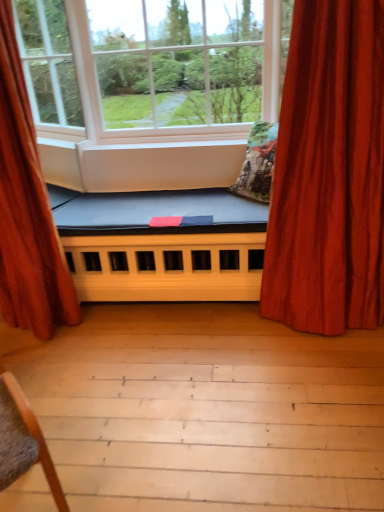
What do you see at coordinates (27, 210) in the screenshot?
I see `velvet red curtain at left, which is the 2th curtain in right-to-left order` at bounding box center [27, 210].

Locate an element on the screen. This screenshot has height=512, width=384. white matte window at center, positioned as the first window in right-to-left order is located at coordinates (184, 64).

The image size is (384, 512). What do you see at coordinates (161, 245) in the screenshot?
I see `blue fabric futon at center` at bounding box center [161, 245].

Looking at this image, measure the distance between blue fabric futon at center and camera.

blue fabric futon at center and camera are 2.18 meters apart.

Where is `velvet red curtain at left, which is the 2th curtain in right-to-left order`? The image size is (384, 512). velvet red curtain at left, which is the 2th curtain in right-to-left order is located at coordinates point(27,210).

Is white matte window at center, which ranks as the 2th window in left-to-right order, positioned before clear glass window at upper center, arranged as the 1th window when viewed from the left?

Yes, white matte window at center, which ranks as the 2th window in left-to-right order, is closer to the camera.

In the scene shown: From a real-world perspective, relative to clear glass window at upper center, arranged as the 1th window when viewed from the left, is white matte window at center, which ranks as the 2th window in left-to-right order, vertically above or below?

In terms of real-world spatial position, white matte window at center, which ranks as the 2th window in left-to-right order, is below clear glass window at upper center, arranged as the 1th window when viewed from the left.

Is white matte window at center, which ranks as the 2th window in left-to-right order, bigger than clear glass window at upper center, which appears as the 2th window when viewed from the right?

Indeed, white matte window at center, which ranks as the 2th window in left-to-right order, has a larger size compared to clear glass window at upper center, which appears as the 2th window when viewed from the right.

In order to click on window behind the white matte window at center, positioned as the first window in right-to-left order in this screenshot , I will do `click(48, 63)`.

Is velvet red curtain at right, arranged as the 2th curtain when viewed from the left, at the left side of blue fabric futon at center?

No, velvet red curtain at right, arranged as the 2th curtain when viewed from the left, is not to the left of blue fabric futon at center.

Is velvet red curtain at right, arranged as the 2th curtain when viewed from the left, outside of blue fabric futon at center?

Yes, velvet red curtain at right, arranged as the 2th curtain when viewed from the left, is outside of blue fabric futon at center.

Is velvet red curtain at right, the 1th curtain when ordered from right to left, touching blue fabric futon at center?

No, velvet red curtain at right, the 1th curtain when ordered from right to left, is not in contact with blue fabric futon at center.

From a real-world perspective, who is located higher, velvet red curtain at right, arranged as the 2th curtain when viewed from the left, or blue fabric futon at center?

From a 3D spatial view, velvet red curtain at right, arranged as the 2th curtain when viewed from the left, is above.

Looking at this image, is textured floral pillow at center turned away from velvet red curtain at left, the 1th curtain in the left-to-right sequence?

No, textured floral pillow at center is not facing away from velvet red curtain at left, the 1th curtain in the left-to-right sequence.

Is textured floral pillow at center bigger or smaller than velvet red curtain at left, which is the 2th curtain in right-to-left order?

textured floral pillow at center is smaller than velvet red curtain at left, which is the 2th curtain in right-to-left order.

Considering the positions of points (272, 123) and (39, 253), is point (272, 123) closer to camera compared to point (39, 253)?

No, it is not.

From their relative heights in the image, would you say textured floral pillow at center is taller or shorter than velvet red curtain at left, the 1th curtain in the left-to-right sequence?

Considering their sizes, textured floral pillow at center has less height than velvet red curtain at left, the 1th curtain in the left-to-right sequence.

Is textured floral pillow at center aimed at velvet red curtain at right, the 1th curtain when ordered from right to left?

No, textured floral pillow at center is not facing towards velvet red curtain at right, the 1th curtain when ordered from right to left.

From a real-world perspective, count 1st curtains upward from the textured floral pillow at center and point to it. Please provide its 2D coordinates.

[(329, 173)]

From a real-world perspective, is textured floral pillow at center physically located above or below velvet red curtain at right, the 1th curtain when ordered from right to left?

Clearly, from a real-world perspective, textured floral pillow at center is below velvet red curtain at right, the 1th curtain when ordered from right to left.

Considering the sizes of objects clear glass window at upper center, arranged as the 1th window when viewed from the left, and white matte window at center, positioned as the first window in right-to-left order, in the image provided, who is shorter, clear glass window at upper center, arranged as the 1th window when viewed from the left, or white matte window at center, positioned as the first window in right-to-left order,?

With less height is clear glass window at upper center, arranged as the 1th window when viewed from the left.

Is clear glass window at upper center, which appears as the 2th window when viewed from the right, wider than white matte window at center, which ranks as the 2th window in left-to-right order?

No.

Who is smaller, clear glass window at upper center, arranged as the 1th window when viewed from the left, or white matte window at center, positioned as the first window in right-to-left order?

Smaller between the two is clear glass window at upper center, arranged as the 1th window when viewed from the left.

Would you say clear glass window at upper center, which appears as the 2th window when viewed from the right, is to the left or to the right of white matte window at center, which ranks as the 2th window in left-to-right order, in the picture?

clear glass window at upper center, which appears as the 2th window when viewed from the right, is to the left of white matte window at center, which ranks as the 2th window in left-to-right order.

Could you tell me if white matte window at center, which ranks as the 2th window in left-to-right order, is turned towards velvet red curtain at right, the 1th curtain when ordered from right to left?

No.

From a real-world perspective, is white matte window at center, which ranks as the 2th window in left-to-right order, positioned over velvet red curtain at right, the 1th curtain when ordered from right to left, based on gravity?

Correct, in the physical world, white matte window at center, which ranks as the 2th window in left-to-right order, is higher than velvet red curtain at right, the 1th curtain when ordered from right to left.

Would you say velvet red curtain at right, the 1th curtain when ordered from right to left, is part of white matte window at center, which ranks as the 2th window in left-to-right order,'s contents?

No, velvet red curtain at right, the 1th curtain when ordered from right to left, is not inside white matte window at center, which ranks as the 2th window in left-to-right order.

Considering the positions of points (187, 83) and (294, 312), is point (187, 83) closer to camera compared to point (294, 312)?

No.

Is velvet red curtain at right, arranged as the 2th curtain when viewed from the left, wider than textured floral pillow at center?

Indeed, velvet red curtain at right, arranged as the 2th curtain when viewed from the left, has a greater width compared to textured floral pillow at center.

How much distance is there between velvet red curtain at right, arranged as the 2th curtain when viewed from the left, and textured floral pillow at center?

23.39 inches.

Does velvet red curtain at right, the 1th curtain when ordered from right to left, have a greater height compared to textured floral pillow at center?

Correct, velvet red curtain at right, the 1th curtain when ordered from right to left, is much taller as textured floral pillow at center.

Is velvet red curtain at right, arranged as the 2th curtain when viewed from the left, positioned beyond the bounds of textured floral pillow at center?

Yes.

Where is `window directly beneath the clear glass window at upper center, which appears as the 2th window when viewed from the right (from a real-world perspective)`? The image size is (384, 512). window directly beneath the clear glass window at upper center, which appears as the 2th window when viewed from the right (from a real-world perspective) is located at coordinates (184, 64).

Find the location of a particular element. curtain that appears on the right of blue fabric futon at center is located at coordinates (329, 173).

From the image, which object appears to be farther from velvet red curtain at right, the 1th curtain when ordered from right to left, velvet red curtain at left, which is the 2th curtain in right-to-left order, or clear glass window at upper center, arranged as the 1th window when viewed from the left?

clear glass window at upper center, arranged as the 1th window when viewed from the left, is positioned further to the anchor velvet red curtain at right, the 1th curtain when ordered from right to left.

Based on their spatial positions, is velvet red curtain at left, the 1th curtain in the left-to-right sequence, or velvet red curtain at right, the 1th curtain when ordered from right to left, further from textured floral pillow at center?

velvet red curtain at left, the 1th curtain in the left-to-right sequence.

Consider the image. Looking at the image, which one is located closer to velvet red curtain at right, the 1th curtain when ordered from right to left, white matte window at center, which ranks as the 2th window in left-to-right order, or textured floral pillow at center?

The object closer to velvet red curtain at right, the 1th curtain when ordered from right to left, is textured floral pillow at center.

In the scene shown: Estimate the real-world distances between objects in this image. Which object is closer to textured floral pillow at center, blue fabric futon at center or velvet red curtain at left, the 1th curtain in the left-to-right sequence?

Among the two, blue fabric futon at center is located nearer to textured floral pillow at center.

Looking at the image, which one is located further to velvet red curtain at left, the 1th curtain in the left-to-right sequence, blue fabric futon at center or textured floral pillow at center?

The object further to velvet red curtain at left, the 1th curtain in the left-to-right sequence, is textured floral pillow at center.

Considering their positions, is velvet red curtain at left, the 1th curtain in the left-to-right sequence, positioned further to white matte window at center, positioned as the first window in right-to-left order, than velvet red curtain at right, the 1th curtain when ordered from right to left?

velvet red curtain at right, the 1th curtain when ordered from right to left, is positioned further to the anchor white matte window at center, positioned as the first window in right-to-left order.

Based on their spatial positions, is textured floral pillow at center or clear glass window at upper center, which appears as the 2th window when viewed from the right, further from velvet red curtain at left, the 1th curtain in the left-to-right sequence?

textured floral pillow at center lies further to velvet red curtain at left, the 1th curtain in the left-to-right sequence, than the other object.

Which object lies nearer to the anchor point white matte window at center, positioned as the first window in right-to-left order, velvet red curtain at left, the 1th curtain in the left-to-right sequence, or blue fabric futon at center?

blue fabric futon at center.

This screenshot has width=384, height=512. Identify the location of window located between velvet red curtain at left, which is the 2th curtain in right-to-left order, and white matte window at center, positioned as the first window in right-to-left order, in the left-right direction. (48, 63).

At what (x,y) coordinates should I click in order to perform the action: click on window located between clear glass window at upper center, which appears as the 2th window when viewed from the right, and velvet red curtain at right, the 1th curtain when ordered from right to left, in the left-right direction. Please return your answer as a coordinate pair (x, y). The height and width of the screenshot is (512, 384). Looking at the image, I should click on (184, 64).

What are the coordinates of `futon between velvet red curtain at right, the 1th curtain when ordered from right to left, and textured floral pillow at center from front to back` in the screenshot? It's located at (161, 245).

Identify the location of pillow located between white matte window at center, which ranks as the 2th window in left-to-right order, and velvet red curtain at right, the 1th curtain when ordered from right to left, in the left-right direction. (258, 163).